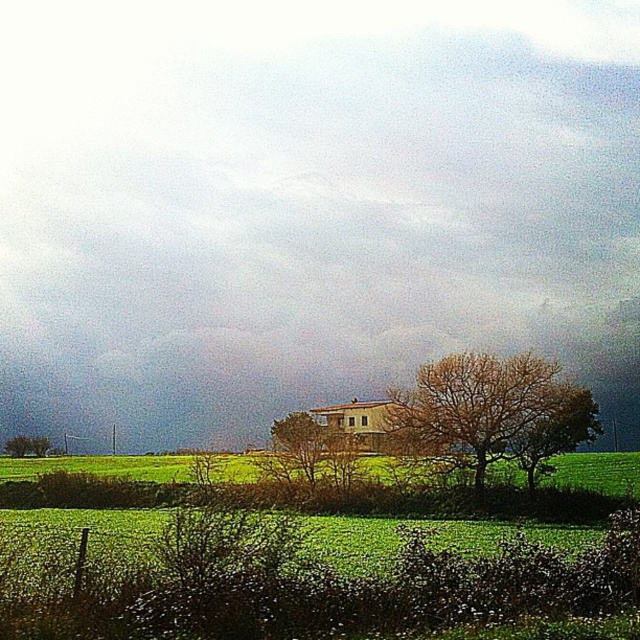
Who is higher up, bare branches at center or green leafy tree at lower left?

bare branches at center is higher up.

Is point (472, 442) positioned before point (17, 444)?

Yes, point (472, 442) is in front of point (17, 444).

Measure the distance between point (x=440, y=460) and camera.

Point (x=440, y=460) and camera are 155.19 feet apart from each other.

Identify the location of bare branches at center. (490, 413).

Who is positioned more to the left, cloudy sky at center or green leafy tree at lower left?

Positioned to the left is green leafy tree at lower left.

Can you confirm if cloudy sky at center is thinner than green leafy tree at lower left?

Incorrect, cloudy sky at center's width is not less than green leafy tree at lower left's.

Is point (634, 348) behind point (12, 451)?

That is True.

Where is `cloudy sky at center`? The width and height of the screenshot is (640, 640). cloudy sky at center is located at coordinates (307, 205).

Measure the distance from cloudy sky at center to bare branches at center.

They are 258.90 feet apart.

Based on the photo, who is lower down, cloudy sky at center or bare branches at center?

bare branches at center

Find the location of a particular element. This screenshot has width=640, height=640. cloudy sky at center is located at coordinates (307, 205).